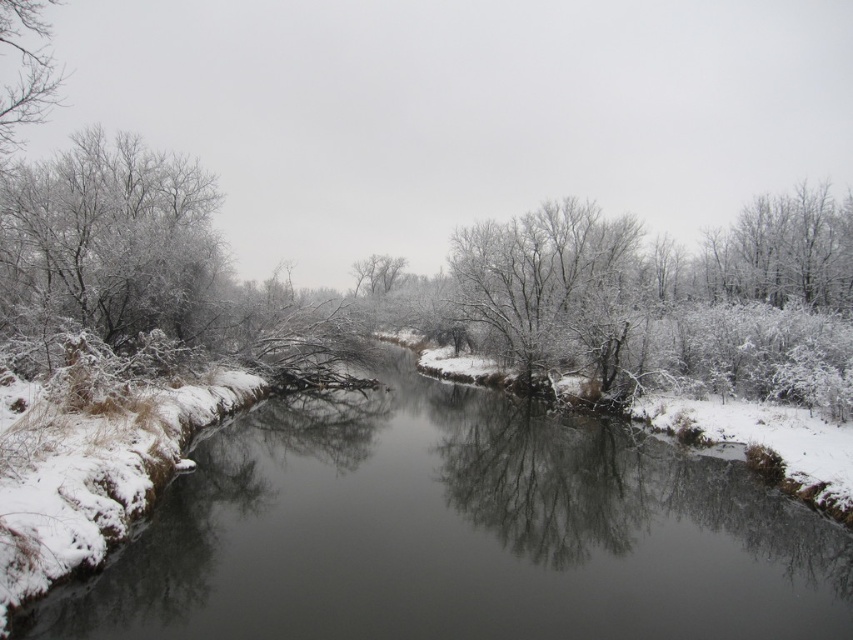
Question: Among these objects, which one is nearest to the camera?

Choices:
 (A) white frosty tree at upper left
 (B) white frosty tree at center
 (C) frosted white tree at left

Answer: (A)

Question: Which of the following is the farthest from the observer?

Choices:
 (A) (733, 536)
 (B) (610, 268)
 (C) (16, 12)

Answer: (B)

Question: Does frosted white tree at left have a smaller size compared to white frosty tree at upper left?

Choices:
 (A) no
 (B) yes

Answer: (B)

Question: Observing the image, what is the correct spatial positioning of snowy river at center in reference to white frosty tree at upper left?

Choices:
 (A) below
 (B) above

Answer: (A)

Question: Does snowy river at center appear over white frosty tree at upper left?

Choices:
 (A) no
 (B) yes

Answer: (A)

Question: Which point is closer to the camera taking this photo?

Choices:
 (A) (561, 310)
 (B) (387, 282)
 (C) (339, 572)
 (D) (49, 83)

Answer: (C)